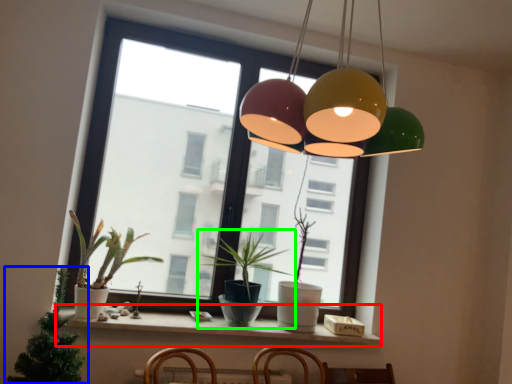
Question: Considering the real-world distances, which object is farthest from window sill (highlighted by a red box)? houseplant (highlighted by a blue box) or houseplant (highlighted by a green box)?

Choices:
 (A) houseplant
 (B) houseplant

Answer: (A)